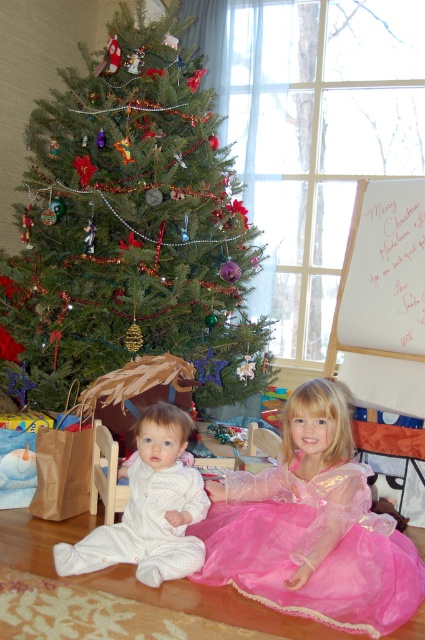
Question: Is green matte christmas tree at upper left wider than pink tulle dress at lower center?

Choices:
 (A) no
 (B) yes

Answer: (B)

Question: Estimate the real-world distances between objects in this image. Which object is closer to the pink tulle dress at lower center?

Choices:
 (A) white soft pajamas at lower left
 (B) green matte christmas tree at upper left

Answer: (A)

Question: From the image, what is the correct spatial relationship of pink tulle dress at lower center in relation to white soft pajamas at lower left?

Choices:
 (A) below
 (B) above

Answer: (A)

Question: Is the position of green matte christmas tree at upper left less distant than that of white soft pajamas at lower left?

Choices:
 (A) yes
 (B) no

Answer: (B)

Question: Which is farther from the pink tulle dress at lower center?

Choices:
 (A) green matte christmas tree at upper left
 (B) white soft pajamas at lower left

Answer: (A)

Question: Which of the following is the closest to the observer?

Choices:
 (A) (186, 499)
 (B) (359, 468)
 (C) (65, 209)

Answer: (B)